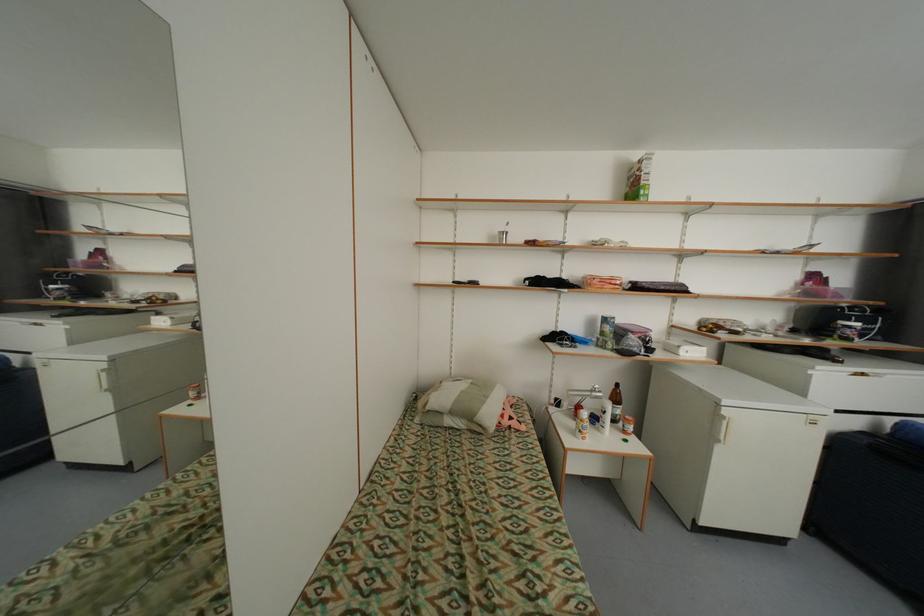
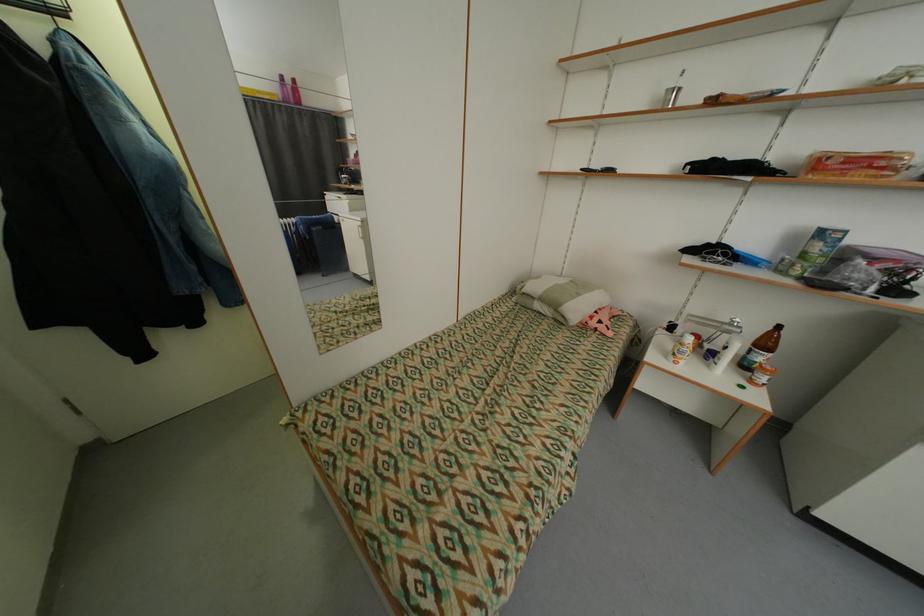
The point at (622, 400) is marked in the first image. Where is the corresponding point in the second image?

(772, 345)